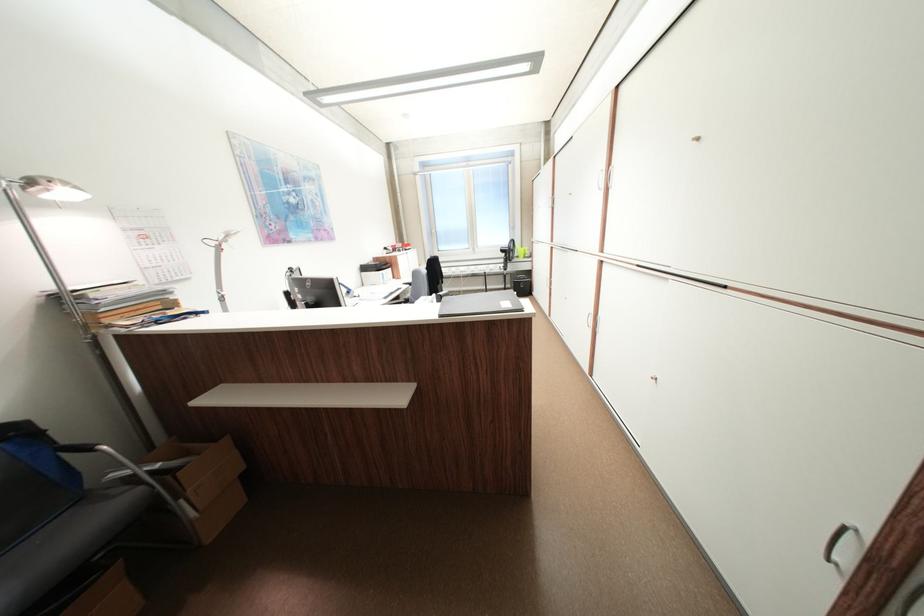
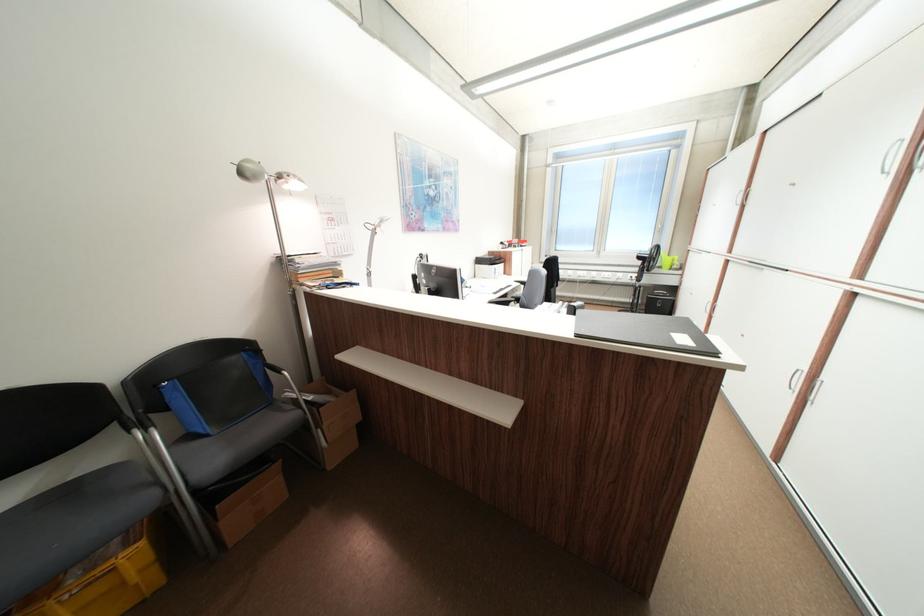
Which direction would the cameraman need to move to produce the second image?

The movement direction of the cameraman is left, forward.